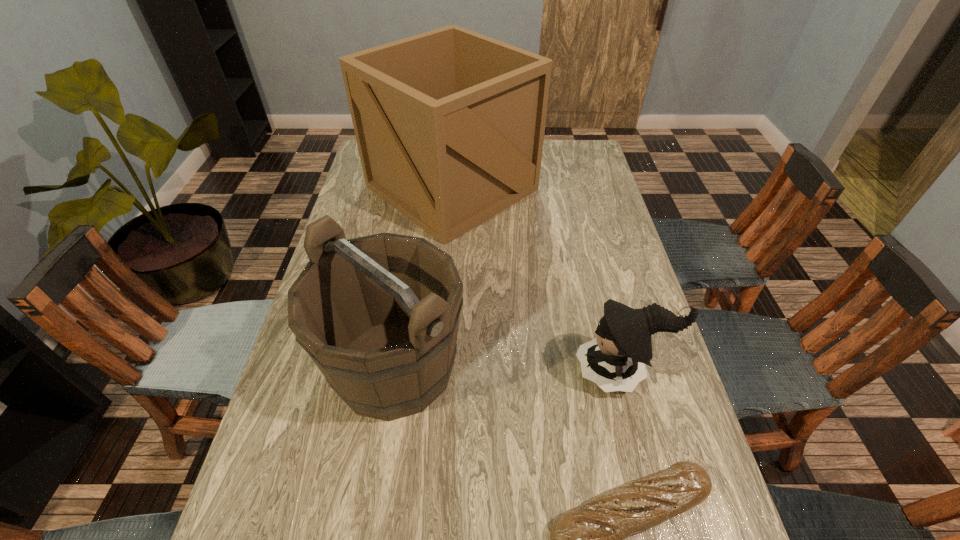
You are a GUI agent. You are given a task and a screenshot of the screen. Output one action in this format:
    pyautogui.click(x=<x>, y=<y>)
    Task: Click on the empty space that is in between the farthest object and the third tallest object
    This screenshot has height=540, width=960.
    Given the screenshot: What is the action you would take?
    pyautogui.click(x=537, y=279)

At what (x,y) coordinates should I click in order to perform the action: click on free space that is in between the third shortest object and the doll. Please return your answer as a coordinate pair (x, y). Looking at the image, I should click on (508, 368).

Select which object appears as the third closest to the doll. Please provide its 2D coordinates. Your answer should be formatted as a tuple, i.e. [(x, y)], where the tuple contains the x and y coordinates of a point satisfying the conditions above.

[(449, 124)]

Point out which object is positioned as the nearest to the doll. Please provide its 2D coordinates. Your answer should be formatted as a tuple, i.e. [(x, y)], where the tuple contains the x and y coordinates of a point satisfying the conditions above.

[(589, 539)]

Where is `vacant space that satisfies the following two spatial constraints: 1. on the back side of the third shortest object; 2. on the left side of the box`? This screenshot has width=960, height=540. vacant space that satisfies the following two spatial constraints: 1. on the back side of the third shortest object; 2. on the left side of the box is located at coordinates (422, 187).

This screenshot has height=540, width=960. I want to click on free space that satisfies the following two spatial constraints: 1. on the back side of the second tallest object; 2. on the right side of the box, so click(422, 187).